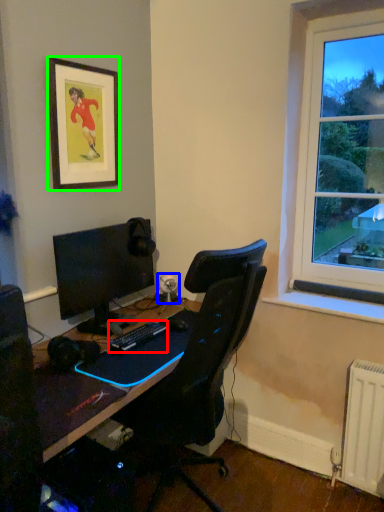
Question: Which is farther away from computer keyboard (highlighted by a red box)? speaker (highlighted by a blue box) or picture frame (highlighted by a green box)?

Choices:
 (A) speaker
 (B) picture frame

Answer: (B)